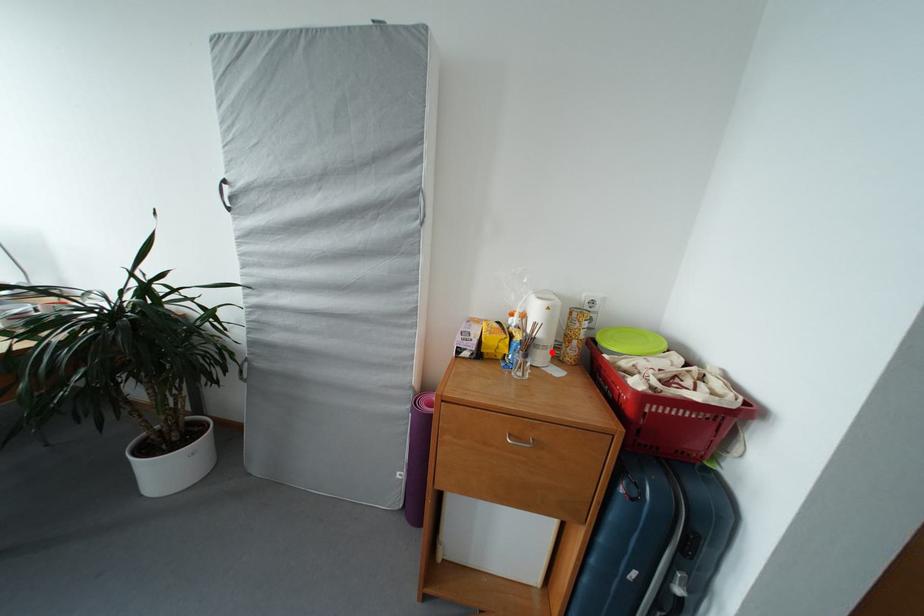
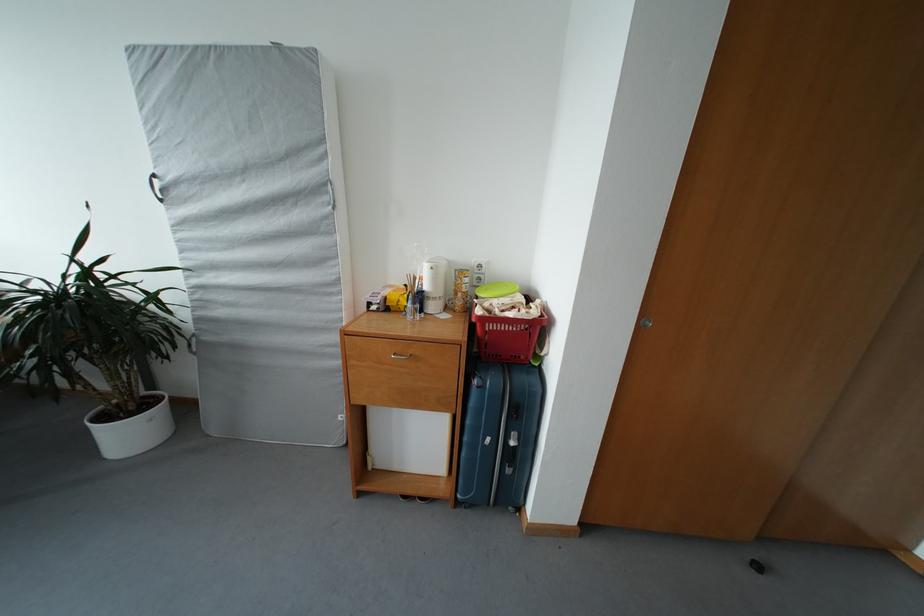
Locate, in the second image, the point that corresponds to the highlighted location in the first image.

(441, 304)